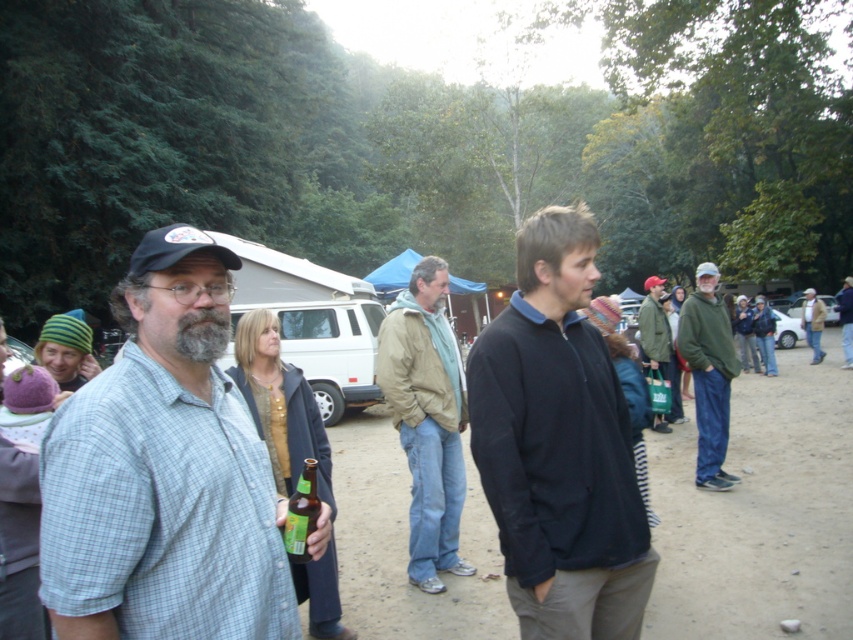
Is black fleece jacket at center positioned in front of green fleece jacket at right?

Yes.

Between black fleece jacket at center and green fleece jacket at right, which one appears on the right side from the viewer's perspective?

green fleece jacket at right is more to the right.

Is point (550, 596) positioned before point (714, 426)?

That is True.

Locate an element on the screen. The height and width of the screenshot is (640, 853). black fleece jacket at center is located at coordinates (560, 444).

Who is lower down, light blue plaid shirt at center or green fleece jacket at right?

green fleece jacket at right

Is light blue plaid shirt at center above green fleece jacket at right?

Yes, light blue plaid shirt at center is above green fleece jacket at right.

Identify the location of light blue plaid shirt at center. This screenshot has height=640, width=853. (164, 472).

Can you confirm if black fleece jacket at center is wider than light brown jacket at center?

Yes.

Which is more to the left, black fleece jacket at center or light brown jacket at center?

From the viewer's perspective, light brown jacket at center appears more on the left side.

The image size is (853, 640). What are the coordinates of `black fleece jacket at center` in the screenshot? It's located at (x=560, y=444).